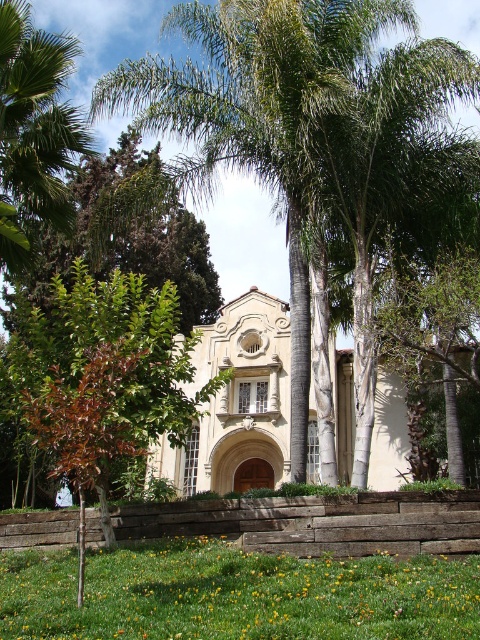
You are standing in front of the Mediterranean building and want to walk from the green leafy palm tree at left to the green grass at lower center. Which direction should you move relative to the palm tree?

You should move downward from the green leafy palm tree at left to reach the green grass at lower center since the green grass at lower center is located below the green leafy palm tree at left.

Based on the photo, you are standing in front of the beige stone chapel at center and want to place a bench to the right of the green leafy palm tree at center. Will the bench be closer to the chapel or the palm tree?

A: The bench will be closer to the beige stone chapel at center because the green leafy palm tree at center is positioned on the left side of the chapel, so placing the bench to the right of the palm tree would place it between the palm tree and the chapel.

You are standing in front of the Mediterranean building and want to walk from the green leafy palm tree at left to the green grass at lower center. Which direction should you move to reach the grass?

To reach the green grass at lower center from the green leafy palm tree at left, you should move towards the center of the scene since the green grass at lower center is wider and occupies more space in that area.